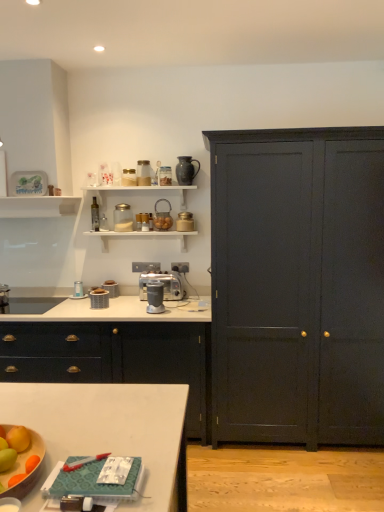
Question: Which is correct: matte black cabinet at center is inside metallic gold canister at upper center, arranged as the 7th appliance when viewed from the top, or outside of it?

Choices:
 (A) outside
 (B) inside

Answer: (A)

Question: Considering the relative positions of matte black cabinet at center and metallic gold canister at upper center, the fifth appliance positioned from the bottom, in the image provided, is matte black cabinet at center to the left or to the right of metallic gold canister at upper center, the fifth appliance positioned from the bottom,?

Choices:
 (A) right
 (B) left

Answer: (B)

Question: Which of these objects is positioned farthest from the metallic silver blender at center, the eighth appliance viewed from the top?

Choices:
 (A) metallic silver toaster at upper center, the eighth appliance in the bottom-to-top sequence
 (B) matte black cabinet at center
 (C) matte gray blender at center, the tenth appliance from the top
 (D) white glossy sink at lower left
 (E) metallic glass bottle at upper center, the 9th appliance positioned from the bottom

Answer: (D)

Question: Which is nearer to the matte black cabinet at center?

Choices:
 (A) metallic silver toaster at upper center, arranged as the 6th appliance when ordered from the bottom
 (B) metallic silver toaster at upper center, which is the 4th appliance from top to bottom
 (C) metallic gold canister at upper center, arranged as the 7th appliance when viewed from the top
 (D) metallic glass bottle at upper center, marked as the 3th appliance in a top-to-bottom arrangement
 (E) transparent glass jar at upper center, which is the seventh appliance in bottom-to-top order

Answer: (E)